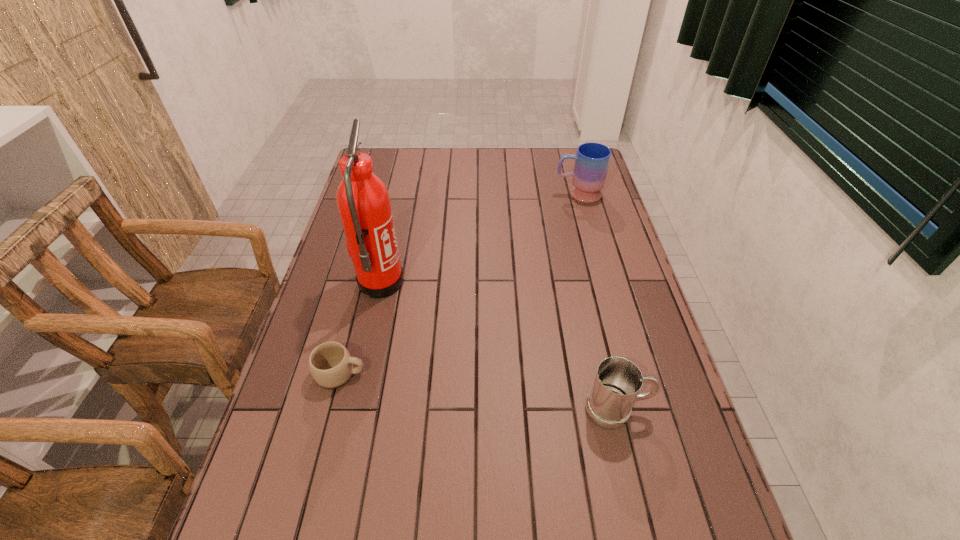
The width and height of the screenshot is (960, 540). In order to click on free region located 0.130m on the side of the tallest mug with the handle in this screenshot , I will do `click(518, 194)`.

Image resolution: width=960 pixels, height=540 pixels. What are the coordinates of `free space located 0.070m on the side of the third tallest object with the handle` in the screenshot? It's located at (679, 409).

The width and height of the screenshot is (960, 540). I want to click on blank area located 0.200m on the side of the shortest object with the handle, so click(x=447, y=374).

This screenshot has width=960, height=540. I want to click on fire extinguisher situated at the left edge, so click(363, 201).

I want to click on mug at the left edge, so click(x=330, y=363).

In the image, there is a desktop. At what (x,y) coordinates should I click in order to perform the action: click on vacant area at the far edge. Please return your answer as a coordinate pair (x, y). Looking at the image, I should click on (483, 149).

Locate an element on the screen. The image size is (960, 540). vacant region at the left edge of the desktop is located at coordinates (369, 296).

In the image, there is a desktop. Where is `free space at the right edge`? free space at the right edge is located at coordinates (565, 195).

Locate an element on the screen. Image resolution: width=960 pixels, height=540 pixels. free region at the far right corner is located at coordinates [x=566, y=151].

Image resolution: width=960 pixels, height=540 pixels. In order to click on free spot between the leftmost mug and the third shortest object in this screenshot , I will do `click(459, 284)`.